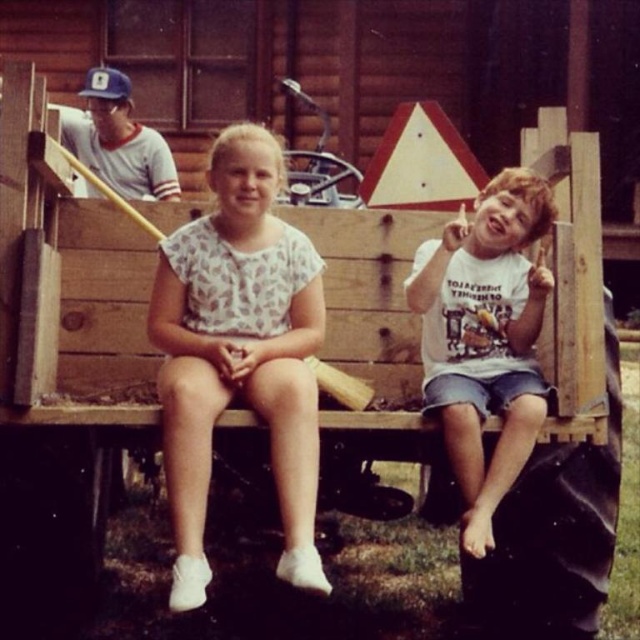
Question: Among these objects, which one is farthest from the camera?

Choices:
 (A) white cotton shirt at right
 (B) white floral dress at center

Answer: (A)

Question: Is white floral dress at center wider than white cotton shirt at right?

Choices:
 (A) yes
 (B) no

Answer: (A)

Question: Which point is farther from the camera taking this photo?

Choices:
 (A) [x=483, y=509]
 (B) [x=179, y=538]

Answer: (A)

Question: Which point is farther to the camera?

Choices:
 (A) (524, 448)
 (B) (204, 572)

Answer: (A)

Question: Is white floral dress at center closer to the viewer compared to white cotton shirt at right?

Choices:
 (A) yes
 (B) no

Answer: (A)

Question: Does white floral dress at center have a larger size compared to white cotton shirt at right?

Choices:
 (A) no
 (B) yes

Answer: (B)